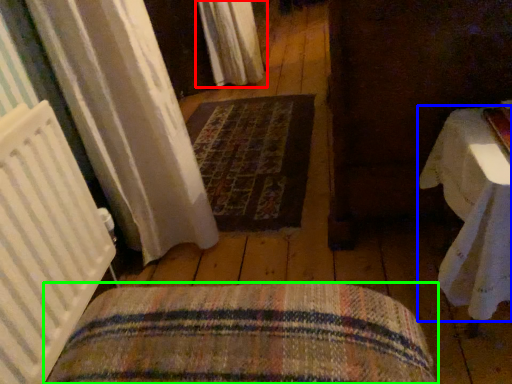
Question: Considering the real-world distances, which object is farthest from curtain (highlighted by a red box)? table (highlighted by a blue box) or furniture (highlighted by a green box)?

Choices:
 (A) table
 (B) furniture

Answer: (B)